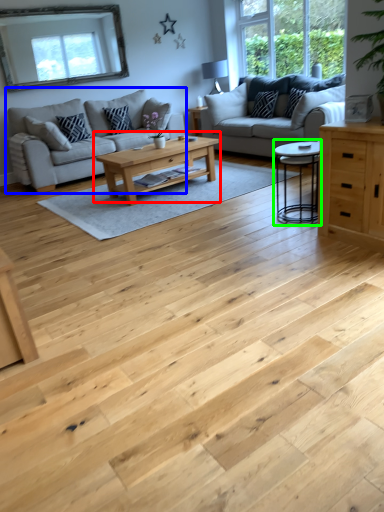
Question: Estimate the real-world distances between objects in this image. Which object is closer to coffee table (highlighted by a red box), studio couch (highlighted by a blue box) or coffee table (highlighted by a green box)?

Choices:
 (A) studio couch
 (B) coffee table

Answer: (B)